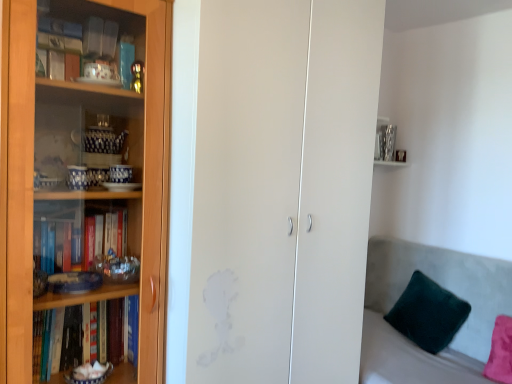
Question: Considering the relative positions of transparent glass cabinet at left and velvety green pillow at lower right in the image provided, is transparent glass cabinet at left in front of velvety green pillow at lower right?

Choices:
 (A) yes
 (B) no

Answer: (A)

Question: Would you say transparent glass cabinet at left contains velvety green pillow at lower right?

Choices:
 (A) yes
 (B) no

Answer: (B)

Question: From the image's perspective, is transparent glass cabinet at left on top of velvety green pillow at lower right?

Choices:
 (A) no
 (B) yes

Answer: (B)

Question: Does transparent glass cabinet at left have a lesser height compared to velvety green pillow at lower right?

Choices:
 (A) yes
 (B) no

Answer: (B)

Question: From a real-world perspective, is transparent glass cabinet at left positioned over velvety green pillow at lower right based on gravity?

Choices:
 (A) no
 (B) yes

Answer: (B)

Question: Choose the correct answer: Is wooden bookcase at left inside velvety green pillow at lower right or outside it?

Choices:
 (A) inside
 (B) outside

Answer: (B)

Question: Is point (139, 6) positioned closer to the camera than point (403, 309)?

Choices:
 (A) closer
 (B) farther

Answer: (A)

Question: From a real-world perspective, is wooden bookcase at left positioned above or below velvety green pillow at lower right?

Choices:
 (A) below
 (B) above

Answer: (B)

Question: In terms of size, does wooden bookcase at left appear bigger or smaller than velvety green pillow at lower right?

Choices:
 (A) big
 (B) small

Answer: (A)

Question: From the image's perspective, is velvety green pillow at lower right located above or below transparent glass cabinet at left?

Choices:
 (A) above
 (B) below

Answer: (B)

Question: From a real-world perspective, is velvety green pillow at lower right physically located above or below transparent glass cabinet at left?

Choices:
 (A) below
 (B) above

Answer: (A)

Question: Considering the relative positions of velvety green pillow at lower right and transparent glass cabinet at left in the image provided, is velvety green pillow at lower right to the left or to the right of transparent glass cabinet at left?

Choices:
 (A) right
 (B) left

Answer: (A)

Question: Considering their positions, is velvety green pillow at lower right located in front of or behind transparent glass cabinet at left?

Choices:
 (A) front
 (B) behind

Answer: (B)

Question: Considering the positions of velvety green pillow at lower right and wooden bookcase at left in the image, is velvety green pillow at lower right bigger or smaller than wooden bookcase at left?

Choices:
 (A) big
 (B) small

Answer: (B)

Question: From the image's perspective, is velvety green pillow at lower right above or below wooden bookcase at left?

Choices:
 (A) below
 (B) above

Answer: (A)